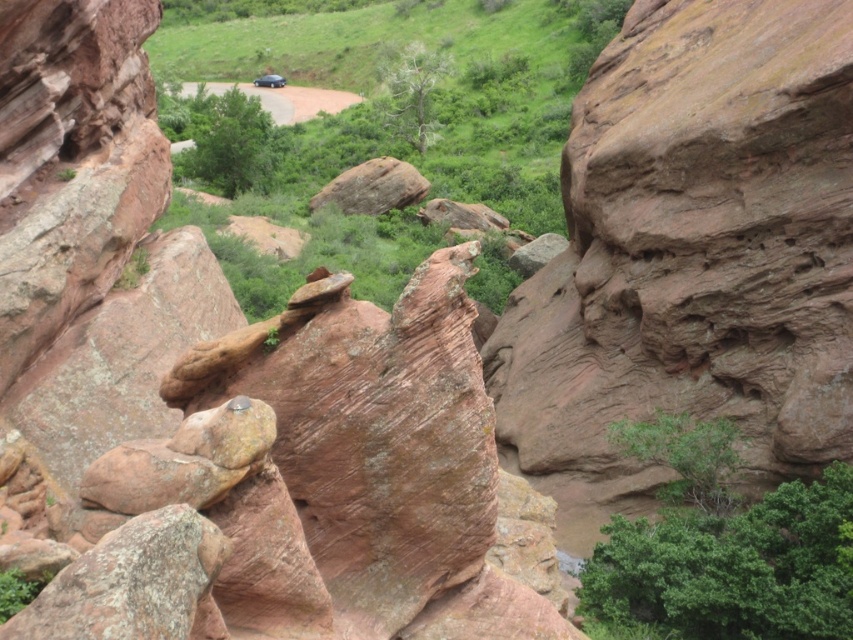
Question: Is rusty stone boulder at center to the right of rusty rock at center from the viewer's perspective?

Choices:
 (A) no
 (B) yes

Answer: (B)

Question: Does rusty stone boulder at center have a smaller size compared to rusty rock at center?

Choices:
 (A) no
 (B) yes

Answer: (A)

Question: Which point is farther to the camera?

Choices:
 (A) rusty stone boulder at center
 (B) rusty rock at center

Answer: (B)

Question: Which object is farther from the camera taking this photo?

Choices:
 (A) rusty rock at center
 (B) rusty stone boulder at center

Answer: (A)

Question: Which point is closer to the camera?

Choices:
 (A) rusty stone boulder at center
 (B) rusty rock at center

Answer: (A)

Question: Observing the image, what is the correct spatial positioning of rusty stone boulder at center in reference to rusty rock at center?

Choices:
 (A) left
 (B) right

Answer: (B)